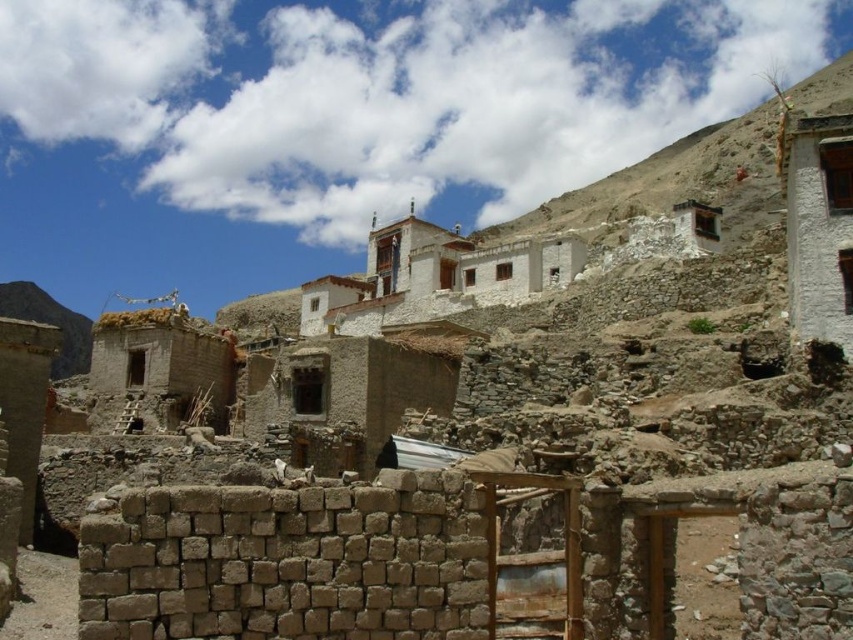
Question: Is white stucco building at upper right smaller than brown stone wall at lower left?

Choices:
 (A) no
 (B) yes

Answer: (B)

Question: Which point is closer to the camera?

Choices:
 (A) brown stone wall at lower left
 (B) white stucco building at upper right

Answer: (A)

Question: Which point is farther to the camera?

Choices:
 (A) (656, 193)
 (B) (16, 298)

Answer: (B)

Question: Which of the following is the farthest from the observer?

Choices:
 (A) (74, 348)
 (B) (722, 198)

Answer: (A)

Question: Is white stucco building at upper right above brown stone wall at lower left?

Choices:
 (A) no
 (B) yes

Answer: (B)

Question: Can you confirm if white stucco building at upper right is positioned below brown stone wall at lower left?

Choices:
 (A) yes
 (B) no

Answer: (B)